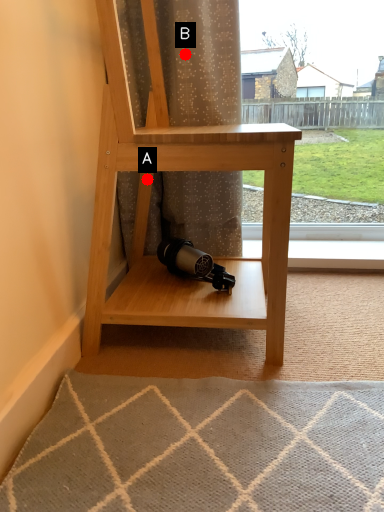
Question: Two points are circled on the image, labeled by A and B beside each circle. Which of the following is the farthest from the observer?

Choices:
 (A) A is further
 (B) B is further

Answer: (A)